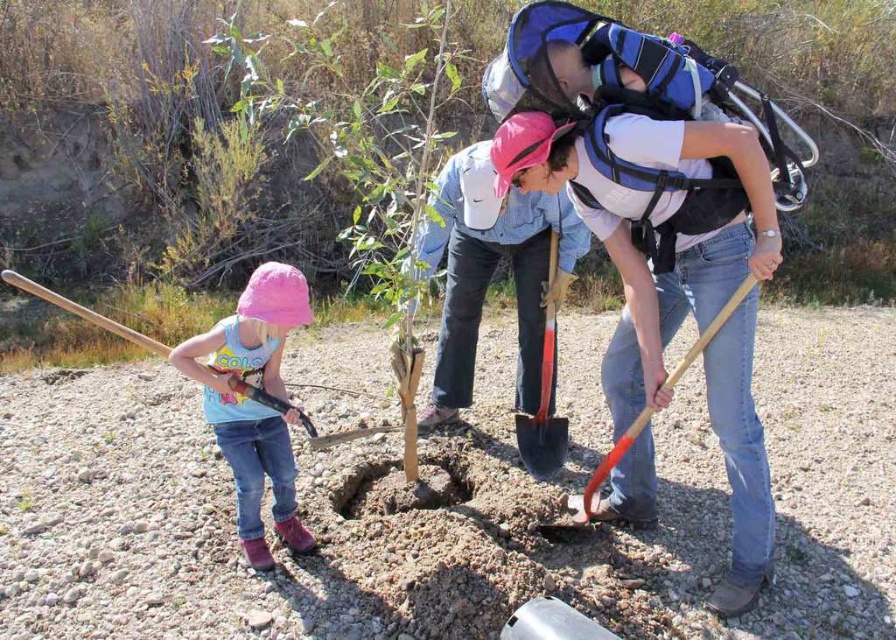
Is point (711, 328) closer to camera compared to point (255, 397)?

Yes, it is in front of point (255, 397).

Can you confirm if orange plastic shovel at center is taller than wooden shovel at left?

Yes, orange plastic shovel at center is taller than wooden shovel at left.

Between point (575, 496) and point (145, 342), which one is positioned in front?

Point (145, 342) is in front.

Where is `orange plastic shovel at center`? This screenshot has width=896, height=640. orange plastic shovel at center is located at coordinates (593, 484).

How distant is pink fabric hat at left from brown dirt hole at center?

pink fabric hat at left is 26.91 inches from brown dirt hole at center.

Is pink fabric hat at left further to camera compared to brown dirt hole at center?

No, it is not.

This screenshot has width=896, height=640. I want to click on pink fabric hat at left, so click(253, 401).

Which of these two, brown dirt hole at center or orange plastic shovel at center, stands shorter?

With less height is brown dirt hole at center.

Does brown dirt hole at center come behind orange plastic shovel at center?

That is True.

What are the coordinates of `brown dirt hole at center` in the screenshot? It's located at (401, 486).